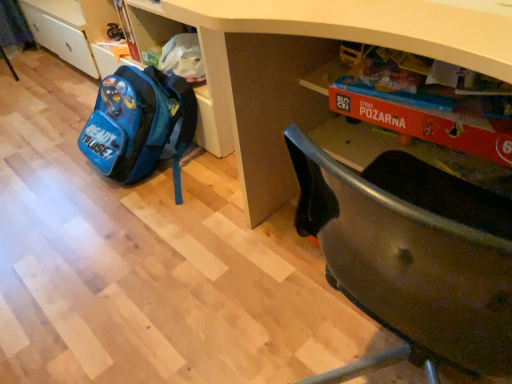
Question: Does white matte desk at center come behind blue fabric backpack at lower left?

Choices:
 (A) no
 (B) yes

Answer: (A)

Question: Is white matte desk at center outside blue fabric backpack at lower left?

Choices:
 (A) no
 (B) yes

Answer: (B)

Question: From a real-world perspective, is white matte desk at center on top of blue fabric backpack at lower left?

Choices:
 (A) no
 (B) yes

Answer: (B)

Question: Considering the relative sizes of white matte desk at center and blue fabric backpack at lower left in the image provided, is white matte desk at center taller than blue fabric backpack at lower left?

Choices:
 (A) yes
 (B) no

Answer: (A)

Question: Is white matte desk at center to the left of blue fabric backpack at lower left from the viewer's perspective?

Choices:
 (A) no
 (B) yes

Answer: (A)

Question: Is white matte desk at center oriented towards blue fabric backpack at lower left?

Choices:
 (A) no
 (B) yes

Answer: (A)

Question: Is blue fabric backpack at lower left behind white matte desk at center?

Choices:
 (A) no
 (B) yes

Answer: (B)

Question: Is blue fabric backpack at lower left with white matte desk at center?

Choices:
 (A) yes
 (B) no

Answer: (B)

Question: Is white matte desk at center located within blue fabric backpack at lower left?

Choices:
 (A) yes
 (B) no

Answer: (B)

Question: Does blue fabric backpack at lower left have a smaller size compared to white matte desk at center?

Choices:
 (A) yes
 (B) no

Answer: (A)

Question: From the image's perspective, is blue fabric backpack at lower left on white matte desk at center?

Choices:
 (A) no
 (B) yes

Answer: (B)

Question: Does blue fabric backpack at lower left have a lesser height compared to white matte desk at center?

Choices:
 (A) yes
 (B) no

Answer: (A)

Question: From a real-world perspective, is white matte desk at center physically located above or below blue fabric backpack at lower left?

Choices:
 (A) below
 (B) above

Answer: (B)